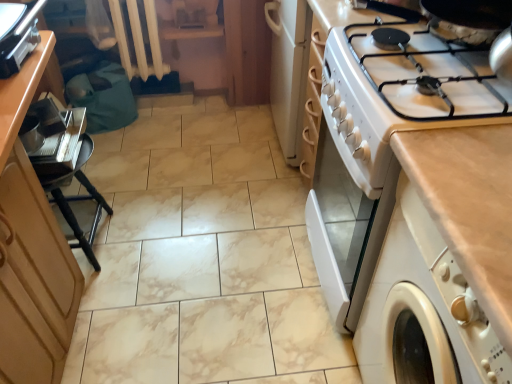
The width and height of the screenshot is (512, 384). I want to click on free point below metallic silver toaster at upper left (from a real-world perspective), so click(x=31, y=56).